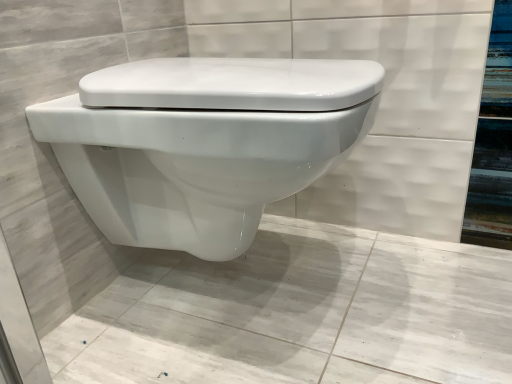
Locate an element on the screen. The width and height of the screenshot is (512, 384). free space above white glossy toilet at center (from a real-world perspective) is located at coordinates (244, 302).